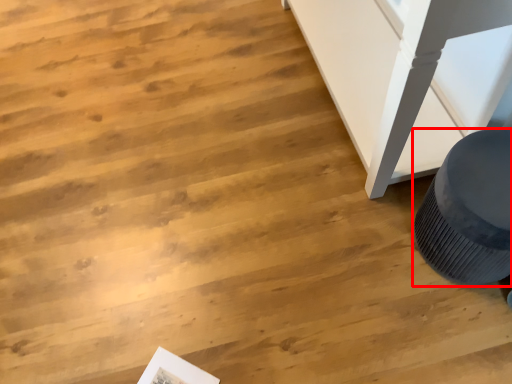
Question: Observing the image, what is the correct spatial positioning of furniture (annotated by the red box) in reference to magazine?

Choices:
 (A) right
 (B) left

Answer: (A)